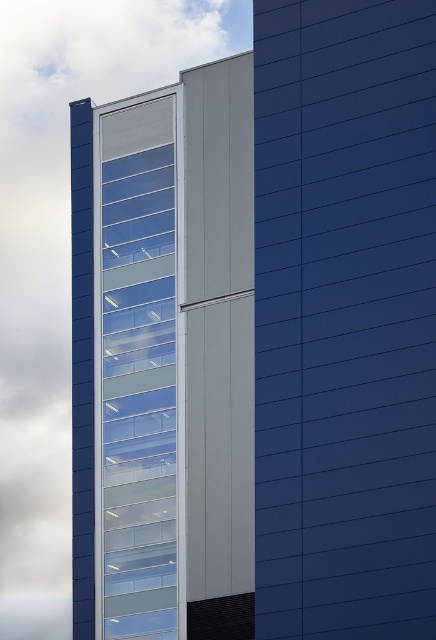
Who is higher up, transparent glass building at center or transparent glass windows at upper left?

transparent glass building at center is higher up.

Does transparent glass building at center appear on the right side of transparent glass windows at upper left?

No, transparent glass building at center is not to the right of transparent glass windows at upper left.

Who is more forward, (75, 97) or (145, 173)?

Point (145, 173) is in front.

Image resolution: width=436 pixels, height=640 pixels. Identify the location of transparent glass building at center. (58, 257).